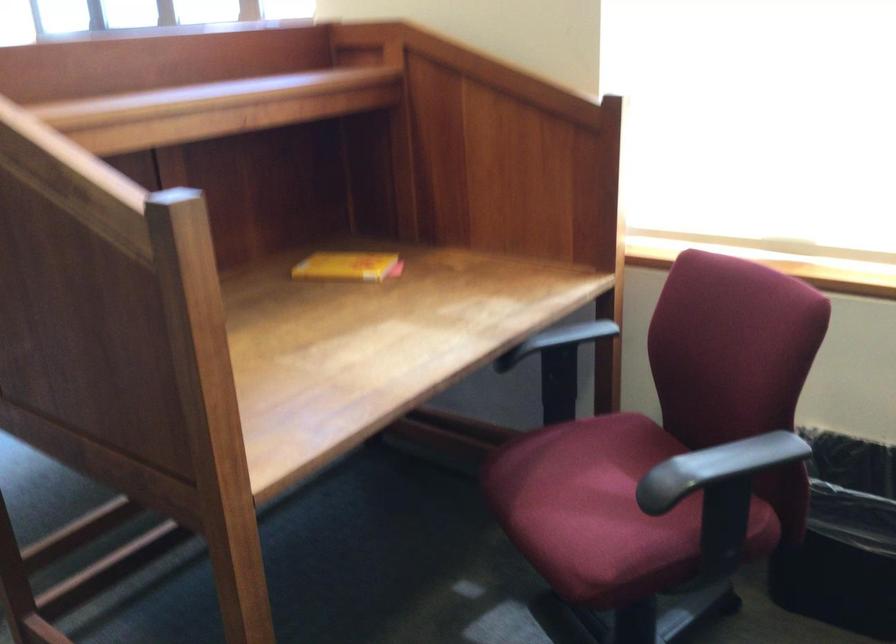
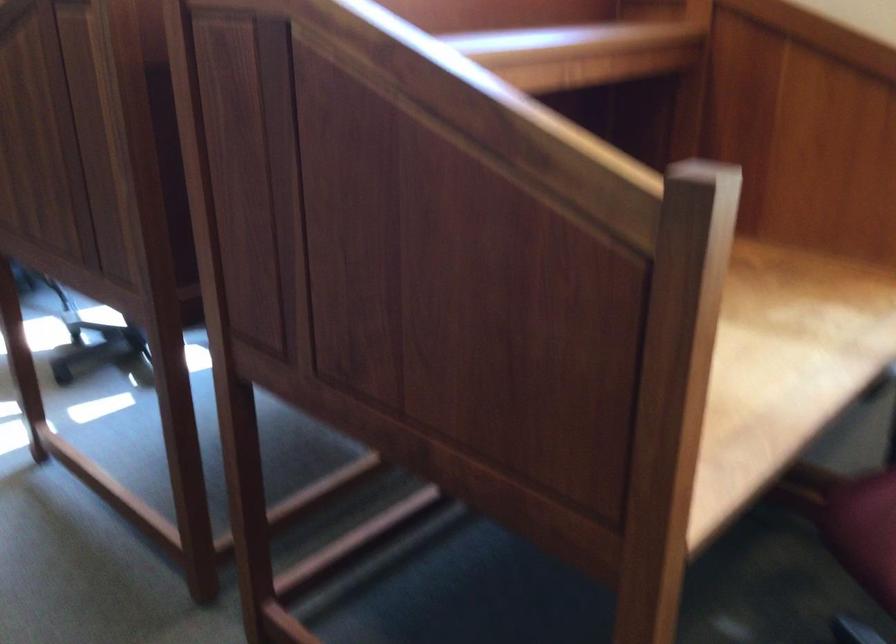
In a continuous first-person perspective shot, in which direction is the camera moving?

The cameraman walked toward left, forward.